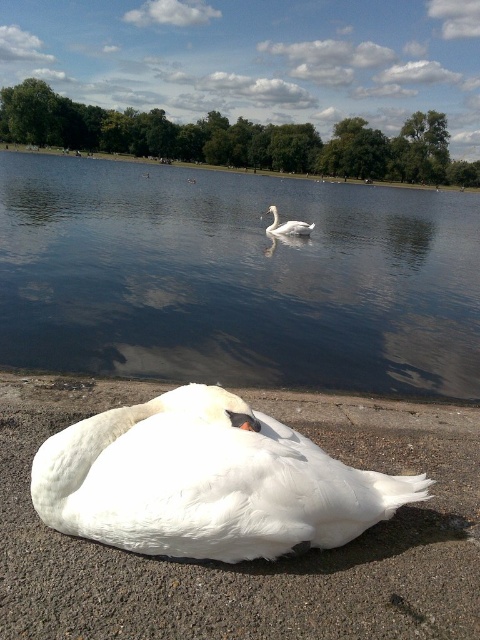
Does glossy water at center appear on the right side of gray concrete curb at lower center?

Incorrect, glossy water at center is not on the right side of gray concrete curb at lower center.

Does glossy water at center have a lesser width compared to gray concrete curb at lower center?

No.

Where is `glossy water at center`? The image size is (480, 640). glossy water at center is located at coordinates (237, 278).

Consider the image. Is glossy water at center positioned before white feathered swan at center?

Yes, glossy water at center is closer to the viewer.

Does glossy water at center appear on the left side of white feathered swan at center?

Yes, glossy water at center is to the left of white feathered swan at center.

Between point (124, 248) and point (287, 227), which one is positioned behind?

Point (287, 227)

Locate an element on the screen. The width and height of the screenshot is (480, 640). glossy water at center is located at coordinates (237, 278).

Which is more to the right, white feathered swan at lower center or white feathered swan at center?

white feathered swan at center is more to the right.

Can you confirm if white feathered swan at lower center is wider than white feathered swan at center?

Indeed, white feathered swan at lower center has a greater width compared to white feathered swan at center.

Where is `white feathered swan at lower center`? This screenshot has width=480, height=640. white feathered swan at lower center is located at coordinates (205, 481).

Where is `white feathered swan at lower center`? white feathered swan at lower center is located at coordinates (205, 481).